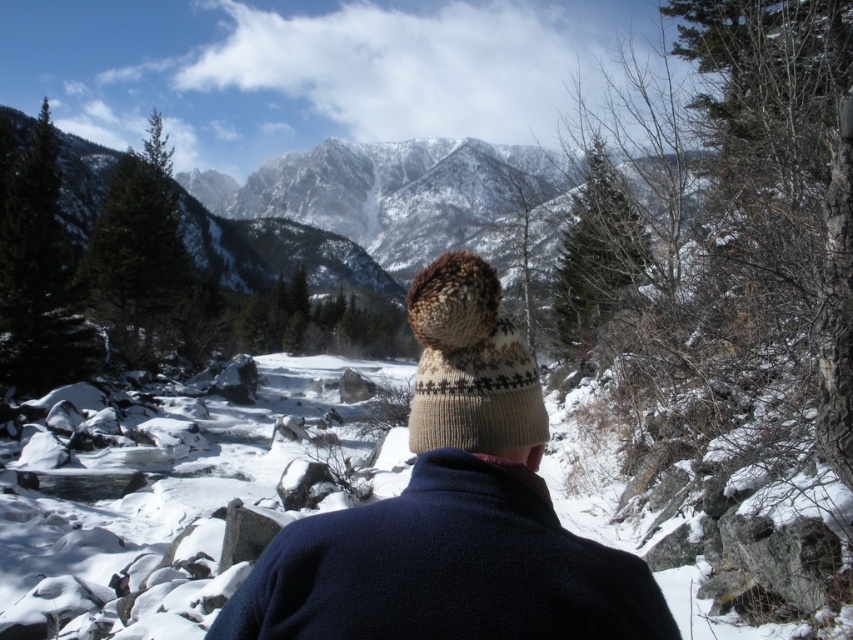
Between knitted wool hat at center and knitted beige hat at center, which one appears on the right side from the viewer's perspective?

knitted beige hat at center

Between point (582, 564) and point (422, 308), which one is positioned in front?

Point (582, 564) is more forward.

Locate an element on the screen. The image size is (853, 640). knitted wool hat at center is located at coordinates (451, 512).